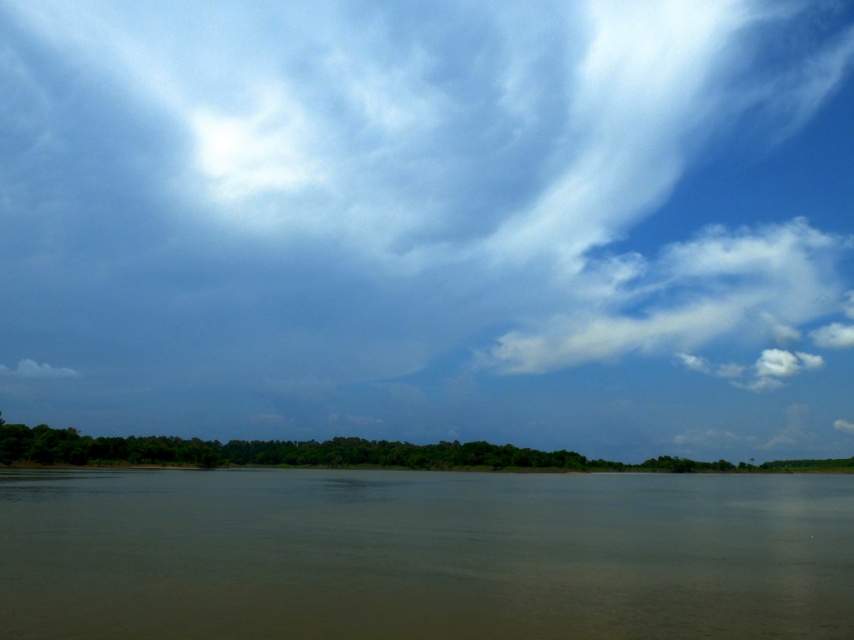
Question: Which of the following is the farthest from the observer?

Choices:
 (A) white fluffy cloud at upper right
 (B) white fluffy cloud at lower left

Answer: (B)

Question: Which object is closer to the camera taking this photo?

Choices:
 (A) brown muddy water at center
 (B) white fluffy cloud at lower left
 (C) blue sky at upper center

Answer: (A)

Question: Can you confirm if white fluffy cloud at upper right is bigger than white fluffy cloud at lower left?

Choices:
 (A) no
 (B) yes

Answer: (B)

Question: Is blue sky at upper center positioned behind white fluffy cloud at upper right?

Choices:
 (A) yes
 (B) no

Answer: (B)

Question: Is blue sky at upper center to the left of white fluffy cloud at upper right from the viewer's perspective?

Choices:
 (A) no
 (B) yes

Answer: (B)

Question: Considering the real-world distances, which object is closest to the blue sky at upper center?

Choices:
 (A) brown muddy water at center
 (B) white fluffy cloud at lower left

Answer: (B)